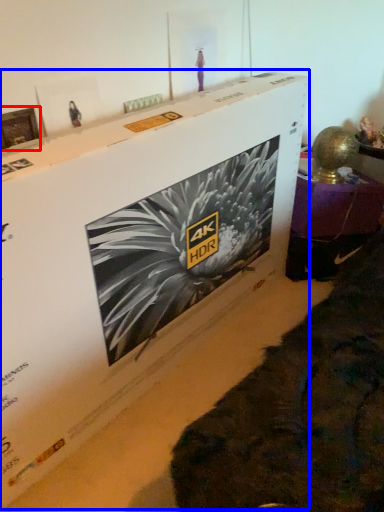
Question: Which object appears closest to the camera in this image, picture frame (highlighted by a red box) or cardboard box (highlighted by a blue box)?

Choices:
 (A) picture frame
 (B) cardboard box

Answer: (B)